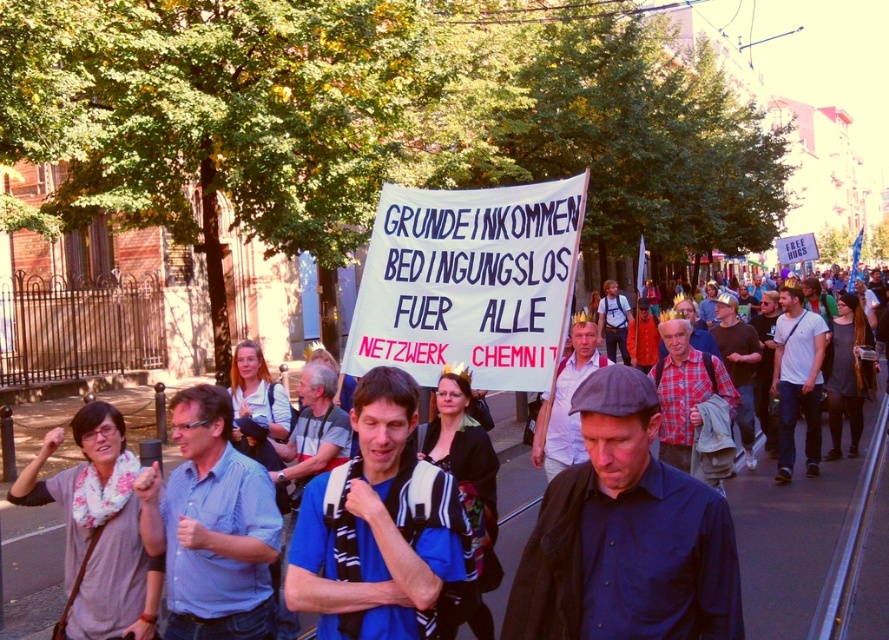
You are a participant in the protest holding a sign. You notice two points marked on your map corresponding to the point at (x=595, y=445) and the point at (x=669, y=388). Which point is closer to you if you are facing the direction of the protest march?

Point at (x=595, y=445) is in front of point at (x=669, y=388), so if you are facing the direction of the protest march, the point at (x=595, y=445) is closer to you.

You are a photographer standing at the edge of the protest. You notice two items at the center of the scene, the dark blue fabric at center and the blue shirt at center. Which one is shorter in height?

The dark blue fabric at center has a lesser height compared to the blue shirt at center, so the dark blue fabric at center is shorter.

You are a photographer standing at the edge of the protest area. You want to capture the white paper sign at center in your shot. Based on its position, where should you aim your camera to ensure the sign is centered in the frame?

To center the white paper sign at center in your frame, aim your camera at the coordinates point (787,541), as that is the 2D location of the white paper sign at center.